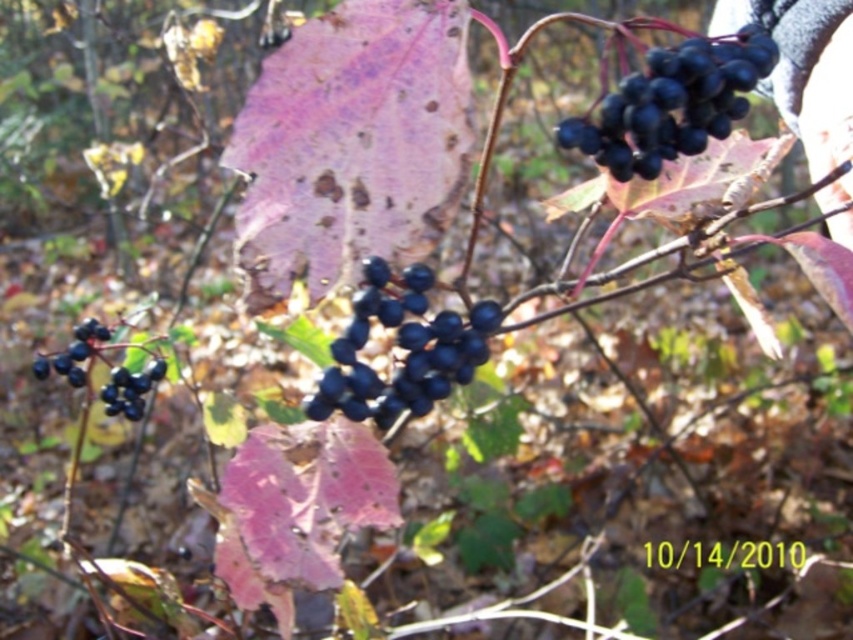
You are a botanist examining the plant in the image. You notice a point marked at coordinates [671,104]. Based on the description, what does this point likely indicate?

The point at coordinates [671,104] indicates shiny black berries at upper right.

You are a nature photographer aiming to capture the shiny black berries at upper right and the shiny dark blue berries at lower left in a single frame. Which berries will appear larger in your photo?

The shiny black berries at upper right will appear larger in your photo because they are closer to the viewer than the shiny dark blue berries at lower left.

You are a botanist examining the plant and need to determine which of the two points, point (668,67) or point (119,404), is nearer to you. Based on the image, which point is closer?

Point (668,67) is closer to the viewer than point (119,404).